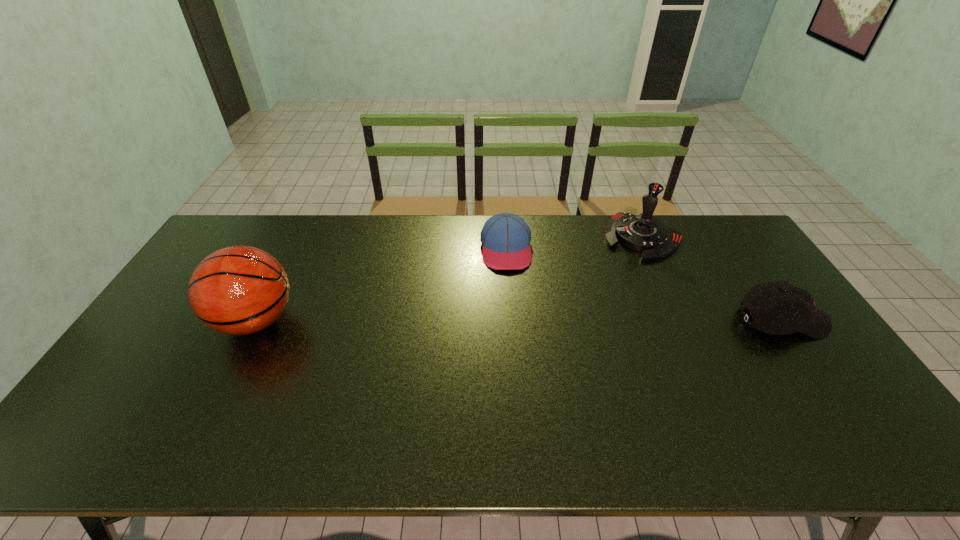
I want to click on free space located on the side with spill of the tallest object, so click(159, 321).

Locate an element on the screen. vacant space situated 0.320m on the front-facing side of the left baseball cap is located at coordinates (517, 349).

I want to click on vacant space located on the front-facing side of the left baseball cap, so click(512, 303).

You are a GUI agent. You are given a task and a screenshot of the screen. Output one action in this format:
    pyautogui.click(x=<x>, y=<y>)
    Task: Click on the vacant region located on the front-facing side of the left baseball cap
    
    Given the screenshot: What is the action you would take?
    pyautogui.click(x=516, y=336)

Identify the location of vacant space situated on the handle side of the joystick. Image resolution: width=960 pixels, height=540 pixels. (594, 298).

Locate an element on the screen. This screenshot has height=540, width=960. vacant region located 0.230m on the handle side of the joystick is located at coordinates (597, 294).

Locate an element on the screen. vacant space located on the handle side of the joystick is located at coordinates (592, 300).

The image size is (960, 540). I want to click on baseball cap at the far edge, so click(x=505, y=237).

Locate an element on the screen. Image resolution: width=960 pixels, height=540 pixels. joystick that is at the far edge is located at coordinates (x=644, y=233).

Where is `object that is at the right edge`? Image resolution: width=960 pixels, height=540 pixels. object that is at the right edge is located at coordinates (788, 309).